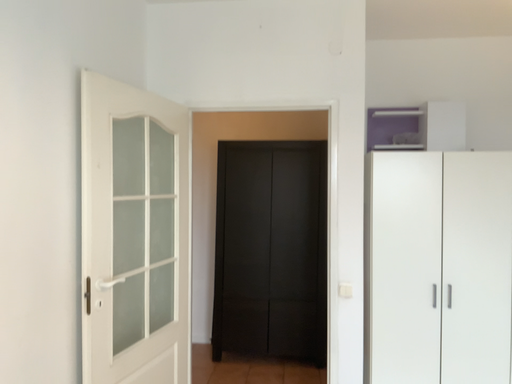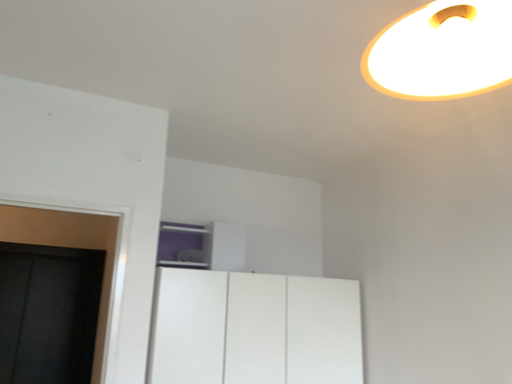
Question: Which way did the camera rotate in the video?

Choices:
 (A) rotated upward
 (B) rotated downward

Answer: (A)